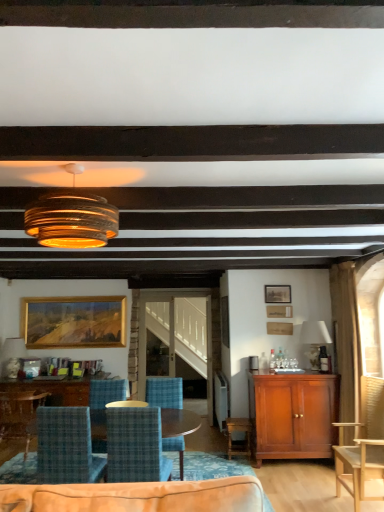
Question: Is mahogany cabinet at right at the back of blue plaid fabric chair at center, arranged as the fourth chair when viewed from the left?

Choices:
 (A) yes
 (B) no

Answer: (B)

Question: Can you confirm if blue plaid fabric chair at center, which ranks as the 2th chair in right-to-left order, is bigger than mahogany cabinet at right?

Choices:
 (A) yes
 (B) no

Answer: (B)

Question: Is blue plaid fabric chair at center, arranged as the fourth chair when viewed from the left, at the left side of mahogany cabinet at right?

Choices:
 (A) yes
 (B) no

Answer: (A)

Question: From the image's perspective, does blue plaid fabric chair at center, arranged as the fourth chair when viewed from the left, appear lower than mahogany cabinet at right?

Choices:
 (A) yes
 (B) no

Answer: (B)

Question: Is blue plaid fabric chair at center, which ranks as the 2th chair in right-to-left order, taller than mahogany cabinet at right?

Choices:
 (A) yes
 (B) no

Answer: (B)

Question: Does blue plaid fabric chair at center, arranged as the fourth chair when viewed from the left, touch mahogany cabinet at right?

Choices:
 (A) yes
 (B) no

Answer: (B)

Question: Is wooden picture frame at upper right, the 2th picture frame in the left-to-right sequence, not near blue plaid chair at lower left, the 2th chair in the left-to-right sequence?

Choices:
 (A) no
 (B) yes

Answer: (B)

Question: From a real-world perspective, is wooden picture frame at upper right, arranged as the 2th picture frame when ordered from the bottom, on blue plaid chair at lower left, placed as the 4th chair when sorted from right to left?

Choices:
 (A) no
 (B) yes

Answer: (B)

Question: Is wooden picture frame at upper right, positioned as the 1th picture frame in right-to-left order, positioned before blue plaid chair at lower left, placed as the 4th chair when sorted from right to left?

Choices:
 (A) yes
 (B) no

Answer: (B)

Question: Can you confirm if wooden picture frame at upper right, the first picture frame when ordered from top to bottom, is wider than blue plaid chair at lower left, placed as the 4th chair when sorted from right to left?

Choices:
 (A) no
 (B) yes

Answer: (A)

Question: Is wooden picture frame at upper right, the 2th picture frame in the left-to-right sequence, positioned with its back to blue plaid chair at lower left, the 2th chair in the left-to-right sequence?

Choices:
 (A) no
 (B) yes

Answer: (A)

Question: Considering the relative sizes of wooden picture frame at upper right, positioned as the 1th picture frame in right-to-left order, and blue plaid chair at lower left, placed as the 4th chair when sorted from right to left, in the image provided, is wooden picture frame at upper right, positioned as the 1th picture frame in right-to-left order, taller than blue plaid chair at lower left, placed as the 4th chair when sorted from right to left,?

Choices:
 (A) no
 (B) yes

Answer: (A)

Question: Is blue plaid fabric chair at center, which ranks as the 2th chair in right-to-left order, facing away from white fabric lampshade at right, marked as the 2th lamp in a top-to-bottom arrangement?

Choices:
 (A) yes
 (B) no

Answer: (B)